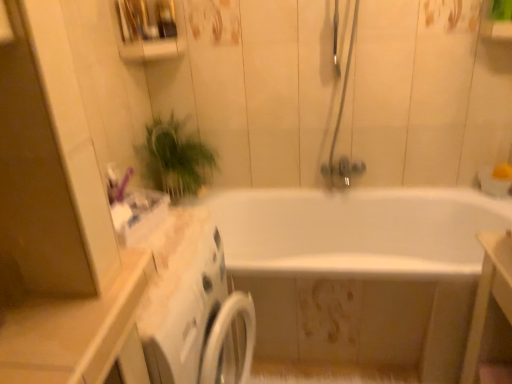
Measure the distance between matte silver shower door at upper center and camera.

1.78 meters.

At what (x,y) coordinates should I click in order to perform the action: click on white glossy bathtub at center. Please return your answer as a coordinate pair (x, y). Looking at the image, I should click on (360, 273).

This screenshot has height=384, width=512. In order to click on green leafy plant at upper left in this screenshot , I will do `click(174, 158)`.

Would you say green leafy plant at upper left is to the left or to the right of white glossy bathtub at center in the picture?

Based on their positions, green leafy plant at upper left is located to the left of white glossy bathtub at center.

Based on the photo, from a real-world perspective, between green leafy plant at upper left and white glossy bathtub at center, who is vertically lower?

In real-world perspective, white glossy bathtub at center is lower.

How many degrees apart are the facing directions of green leafy plant at upper left and white glossy bathtub at center?

green leafy plant at upper left and white glossy bathtub at center are facing 90 degrees away from each other.

From a real-world perspective, is white glossy vanity at lower right on top of green leafy plant at upper left?

Incorrect, from a real-world perspective, white glossy vanity at lower right is lower than green leafy plant at upper left.

Considering the sizes of objects white glossy vanity at lower right and green leafy plant at upper left in the image provided, who is bigger, white glossy vanity at lower right or green leafy plant at upper left?

white glossy vanity at lower right.

Would you say white glossy vanity at lower right is a long distance from green leafy plant at upper left?

white glossy vanity at lower right is positioned a significant distance from green leafy plant at upper left.

Who is shorter, matte silver shower door at upper center or green leafy plant at upper left?

With less height is green leafy plant at upper left.

Is matte silver shower door at upper center looking in the opposite direction of green leafy plant at upper left?

No.

Which object is positioned more to the left, matte silver shower door at upper center or green leafy plant at upper left?

From the viewer's perspective, green leafy plant at upper left appears more on the left side.

Is matte silver shower door at upper center wider than green leafy plant at upper left?

No, matte silver shower door at upper center is not wider than green leafy plant at upper left.

Considering the sizes of white glossy vanity at lower right and white glossy bathtub at center in the image, is white glossy vanity at lower right wider or thinner than white glossy bathtub at center?

In the image, white glossy vanity at lower right appears to be more narrow than white glossy bathtub at center.

Is white glossy vanity at lower right at the left side of white glossy bathtub at center?

Incorrect, white glossy vanity at lower right is not on the left side of white glossy bathtub at center.

Where is `bathtub located behind the white glossy vanity at lower right`? bathtub located behind the white glossy vanity at lower right is located at coordinates (360, 273).

Does white glossy vanity at lower right lie behind white glossy bathtub at center?

No, the depth of white glossy vanity at lower right is less than that of white glossy bathtub at center.

Would you say white glossy bathtub at center is to the left or to the right of green leafy plant at upper left in the picture?

From the image, it's evident that white glossy bathtub at center is to the right of green leafy plant at upper left.

Does white glossy bathtub at center turn towards green leafy plant at upper left?

No, white glossy bathtub at center is not oriented towards green leafy plant at upper left.

Considering the sizes of objects white glossy bathtub at center and green leafy plant at upper left in the image provided, who is wider, white glossy bathtub at center or green leafy plant at upper left?

white glossy bathtub at center.

What are the coordinates of `bathtub on the left of matte silver shower door at upper center` in the screenshot? It's located at (360, 273).

Who is taller, matte silver shower door at upper center or white glossy bathtub at center?

With more height is matte silver shower door at upper center.

Which object is positioned more to the right, matte silver shower door at upper center or white glossy bathtub at center?

From the viewer's perspective, matte silver shower door at upper center appears more on the right side.

Is matte silver shower door at upper center positioned beyond the bounds of white glossy bathtub at center?

Yes, matte silver shower door at upper center is located beyond the bounds of white glossy bathtub at center.

Which object is further away from the camera, white glossy bathtub at center or white glossy vanity at lower right?

white glossy bathtub at center is behind.

Is white glossy bathtub at center with white glossy vanity at lower right?

white glossy bathtub at center and white glossy vanity at lower right are not in contact.

Where is `bathtub above the white glossy vanity at lower right (from the image's perspective)`? This screenshot has width=512, height=384. bathtub above the white glossy vanity at lower right (from the image's perspective) is located at coordinates (360, 273).

Does white glossy bathtub at center have a greater width compared to white glossy vanity at lower right?

Correct, the width of white glossy bathtub at center exceeds that of white glossy vanity at lower right.

Where is `bathtub below the green leafy plant at upper left (from the image's perspective)`? The height and width of the screenshot is (384, 512). bathtub below the green leafy plant at upper left (from the image's perspective) is located at coordinates (360, 273).

The image size is (512, 384). I want to click on houseplant on the left side of white glossy vanity at lower right, so click(x=174, y=158).

Which object lies nearer to the anchor point matte silver shower door at upper center, white glossy vanity at lower right or white glossy bathtub at center?

Based on the image, white glossy bathtub at center appears to be nearer to matte silver shower door at upper center.

Looking at the image, which one is located further to white glossy bathtub at center, green leafy plant at upper left or white glossy vanity at lower right?

white glossy vanity at lower right is positioned further to the anchor white glossy bathtub at center.

From the image, which object appears to be nearer to green leafy plant at upper left, matte silver shower door at upper center or white glossy vanity at lower right?

The object closer to green leafy plant at upper left is matte silver shower door at upper center.

Looking at the image, which one is located further to green leafy plant at upper left, matte silver shower door at upper center or white glossy bathtub at center?

Among the two, matte silver shower door at upper center is located further to green leafy plant at upper left.

From the image, which object appears to be nearer to green leafy plant at upper left, white glossy bathtub at center or matte silver shower door at upper center?

white glossy bathtub at center is closer to green leafy plant at upper left.

Considering their positions, is white glossy vanity at lower right positioned further to white glossy bathtub at center than green leafy plant at upper left?

Among the two, white glossy vanity at lower right is located further to white glossy bathtub at center.

Which object lies nearer to the anchor point white glossy bathtub at center, white glossy vanity at lower right or matte silver shower door at upper center?

matte silver shower door at upper center is closer to white glossy bathtub at center.

From the image, which object appears to be nearer to matte silver shower door at upper center, white glossy vanity at lower right or green leafy plant at upper left?

Among the two, green leafy plant at upper left is located nearer to matte silver shower door at upper center.

The width and height of the screenshot is (512, 384). What are the coordinates of `bathtub located between green leafy plant at upper left and matte silver shower door at upper center in the left-right direction` in the screenshot? It's located at pyautogui.click(x=360, y=273).

The image size is (512, 384). Identify the location of bathtub between matte silver shower door at upper center and white glossy vanity at lower right in the vertical direction. (360, 273).

Locate an element on the screen. The width and height of the screenshot is (512, 384). bathtub between green leafy plant at upper left and white glossy vanity at lower right from left to right is located at coordinates (360, 273).

Identify the location of shower door between green leafy plant at upper left and white glossy vanity at lower right in the horizontal direction. The width and height of the screenshot is (512, 384). (339, 129).